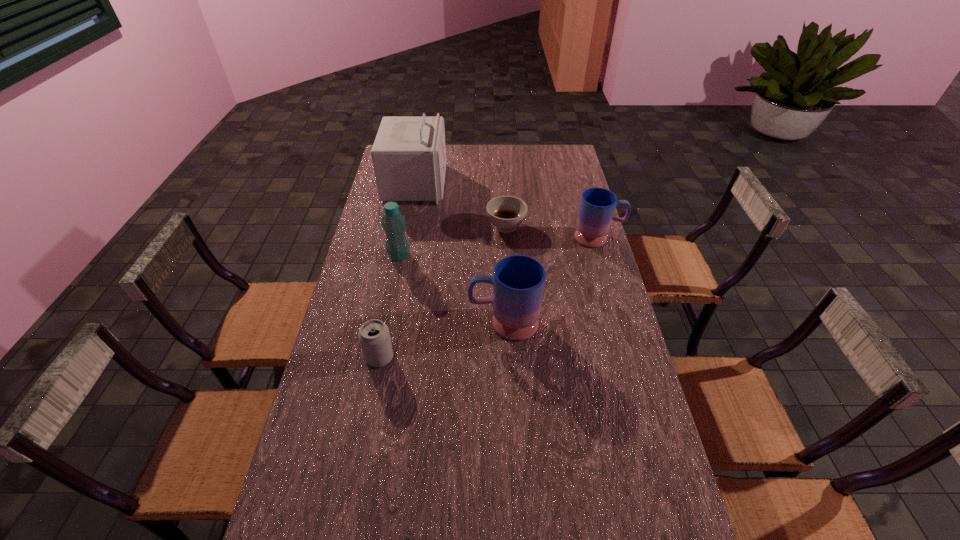
The image size is (960, 540). I want to click on can located at the left edge, so click(374, 336).

The image size is (960, 540). What are the coordinates of `object that is at the right edge` in the screenshot? It's located at (597, 205).

You are a GUI agent. You are given a task and a screenshot of the screen. Output one action in this format:
    pyautogui.click(x=<x>, y=<y>)
    Task: Click on the object situated at the far left corner
    The height and width of the screenshot is (540, 960).
    Given the screenshot: What is the action you would take?
    pyautogui.click(x=409, y=152)

In order to click on free space at the near edge in this screenshot , I will do `click(391, 527)`.

Identify the location of free space at the left edge of the desktop. (370, 311).

Where is `vacant region at the right edge of the desktop`? This screenshot has height=540, width=960. vacant region at the right edge of the desktop is located at coordinates (601, 271).

The height and width of the screenshot is (540, 960). I want to click on vacant space at the near left corner, so click(286, 519).

You are a GUI agent. You are given a task and a screenshot of the screen. Output one action in this format:
    pyautogui.click(x=<x>, y=<y>)
    Task: Click on the vacant space at the far right corner
    
    Given the screenshot: What is the action you would take?
    pyautogui.click(x=568, y=166)

Locate an element on the screen. This screenshot has width=960, height=540. free space between the taller mug and the right mug is located at coordinates (551, 280).

Where is `free space between the nearest object and the shortest object`? Image resolution: width=960 pixels, height=540 pixels. free space between the nearest object and the shortest object is located at coordinates (443, 292).